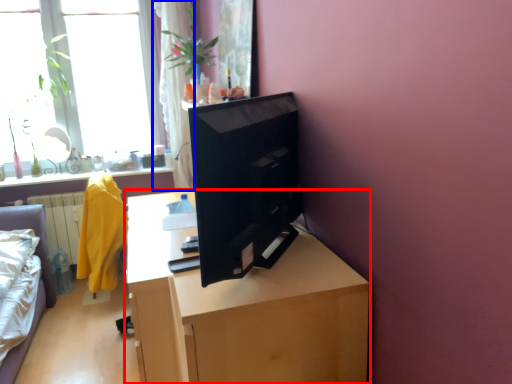
Question: Which point is closer to the camera, desk (highlighted by a red box) or curtain (highlighted by a blue box)?

Choices:
 (A) desk
 (B) curtain

Answer: (A)